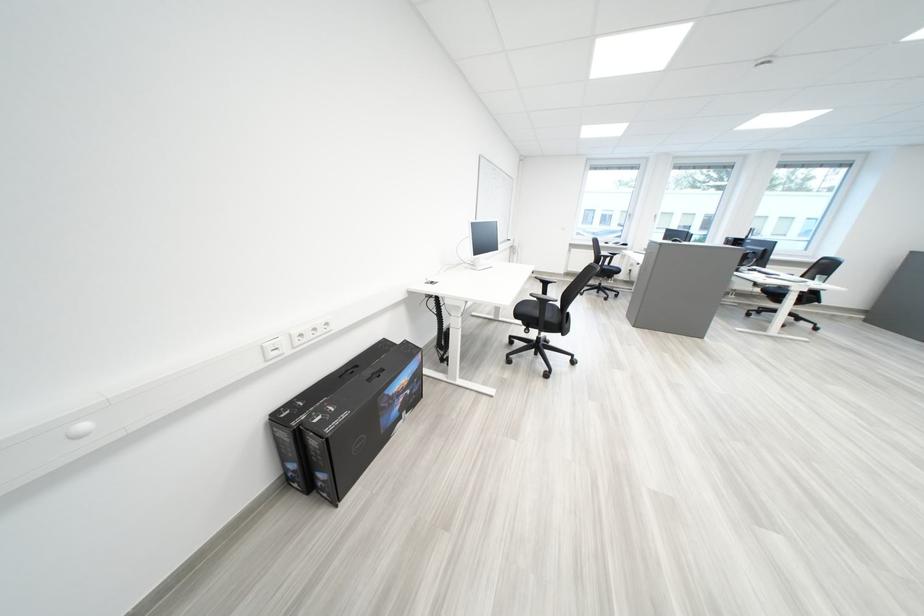
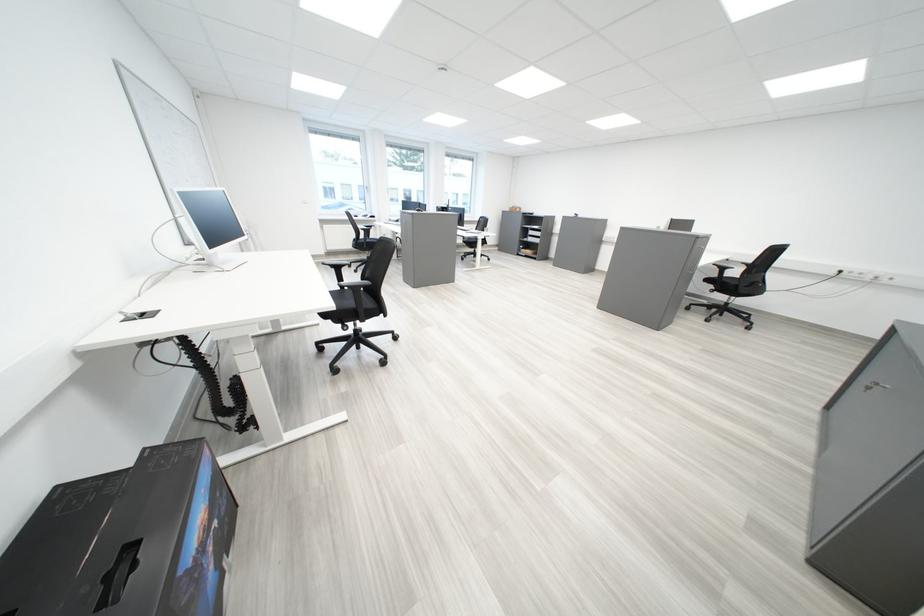
Question: Based on the continuous images, in which direction is the camera rotating? Reply with the corresponding letter.

Choices:
 (A) Left
 (B) Right
 (C) Up
 (D) Down

Answer: (B)